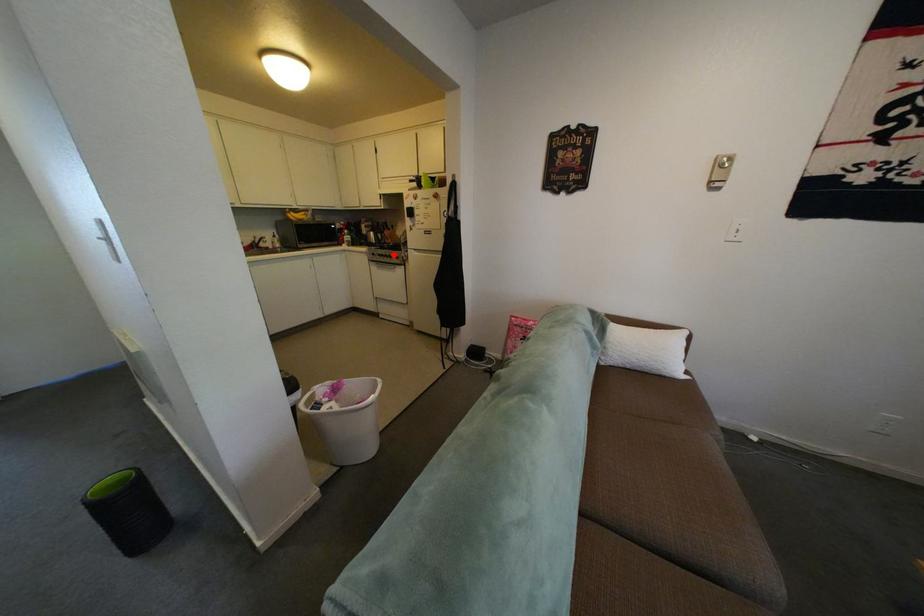
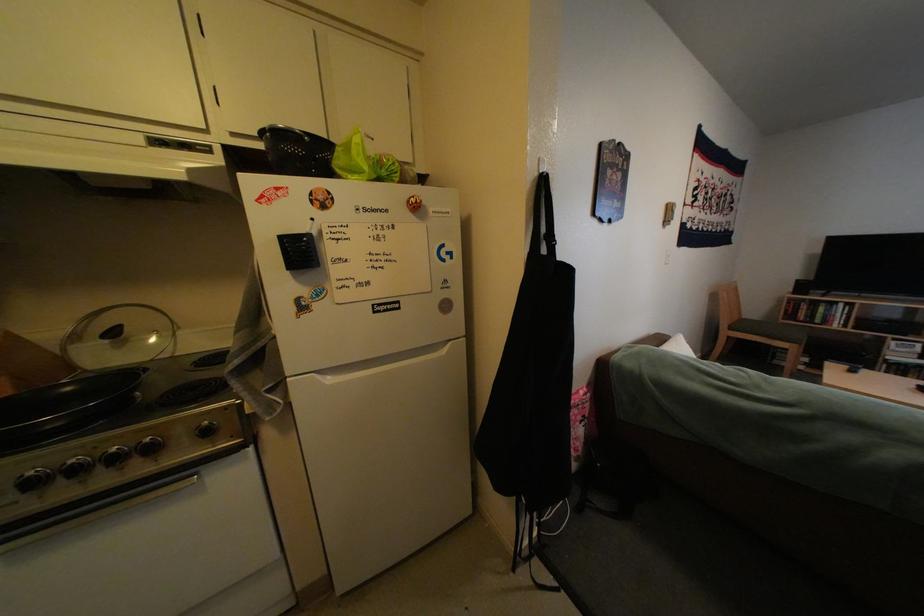
The point at the highlighted location is marked in the first image. Where is the corresponding point in the second image?

(45, 475)